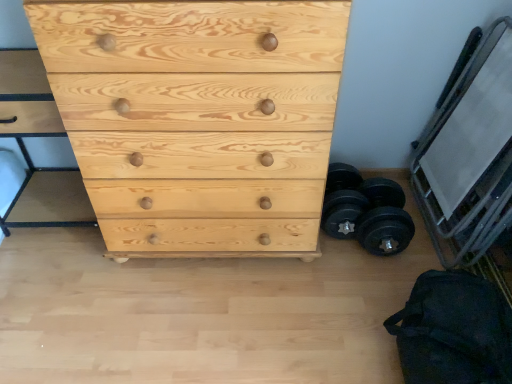
Image resolution: width=512 pixels, height=384 pixels. Find the location of `free space in front of natural wood chest of drawers at center`. free space in front of natural wood chest of drawers at center is located at coordinates (204, 318).